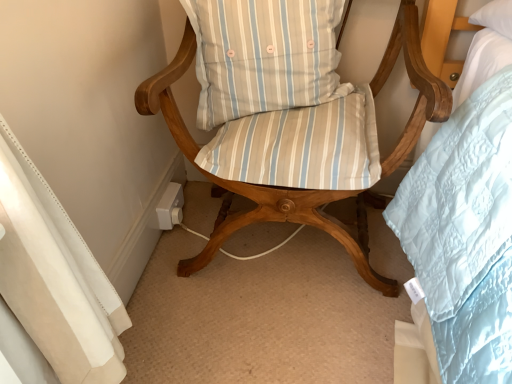
Identify the location of free spot below wooden chair with striped cushions at center (from a real-world perspective). (288, 262).